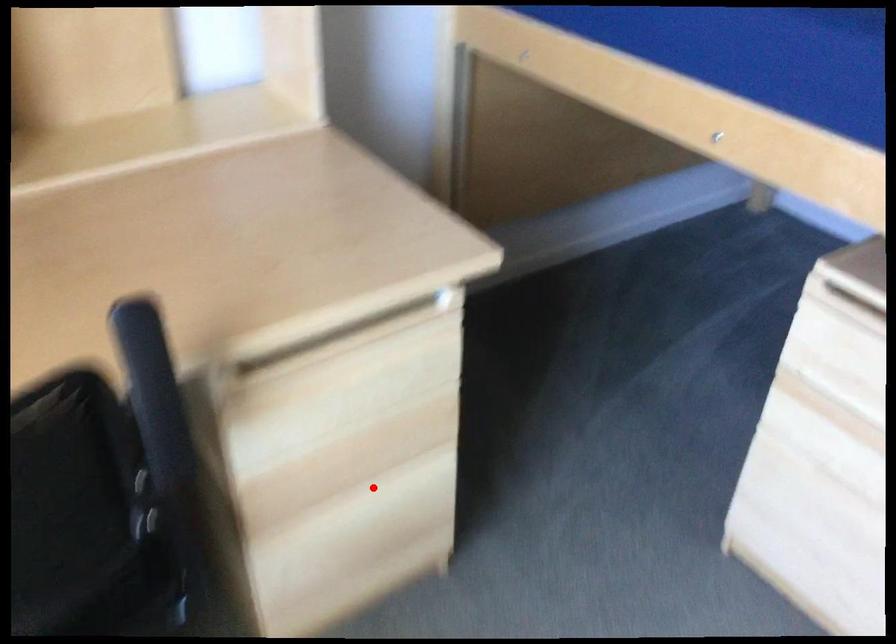
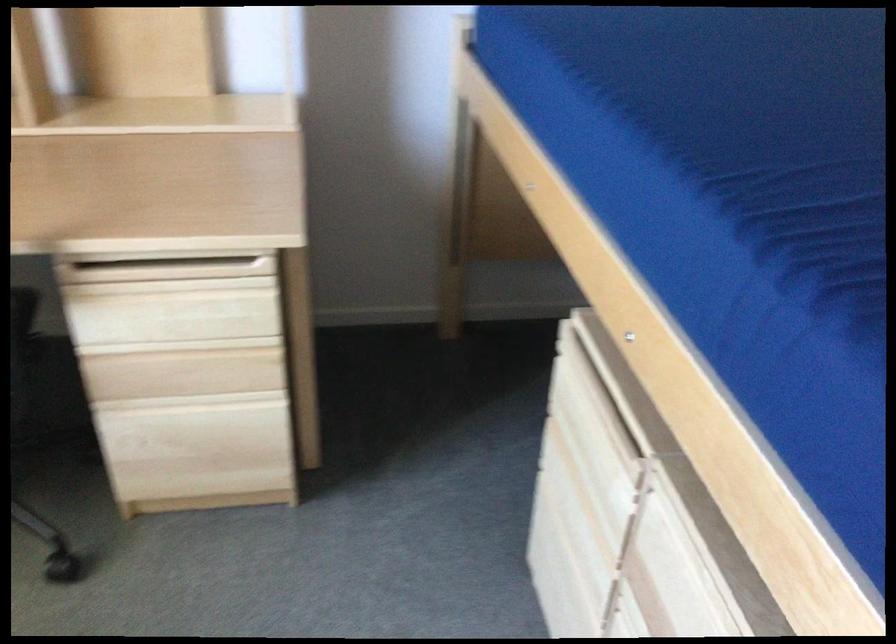
Where in the second image is the point corresponding to the highlighted location from the first image?

(192, 401)